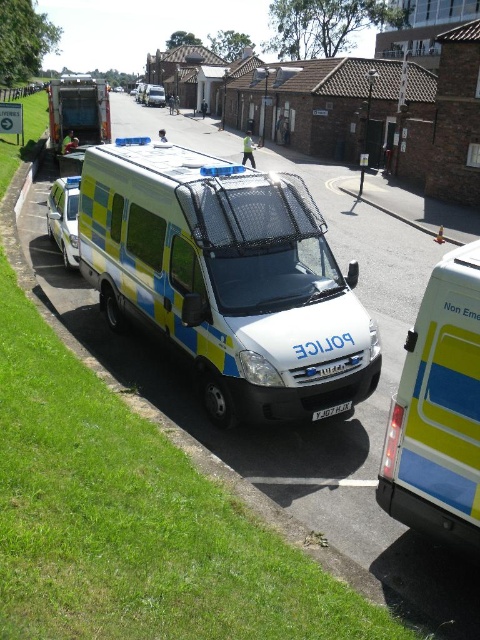
Consider the image. Who is positioned more to the right, blue and yellow painted police van at center or blue and yellow painted van at center?

blue and yellow painted police van at center

Does blue and yellow painted police van at center have a smaller size compared to blue and yellow painted van at center?

Indeed, blue and yellow painted police van at center has a smaller size compared to blue and yellow painted van at center.

In order to click on blue and yellow painted police van at center in this screenshot , I will do `click(227, 278)`.

This screenshot has width=480, height=640. What do you see at coordinates (439, 410) in the screenshot? I see `yellow and blue plastic van at right` at bounding box center [439, 410].

Between point (409, 506) and point (100, 140), which one is positioned in front?

Point (409, 506) is in front.

At what (x,y) coordinates should I click in order to perform the action: click on yellow and blue plastic van at right. Please return your answer as a coordinate pair (x, y). Image resolution: width=480 pixels, height=640 pixels. Looking at the image, I should click on (439, 410).

Does point (99, 163) come behind point (464, 483)?

Yes, point (99, 163) is farther from viewer.

Is point (257, 237) positioned behind point (478, 332)?

Yes, it is.

This screenshot has width=480, height=640. I want to click on blue and yellow painted police van at center, so click(x=227, y=278).